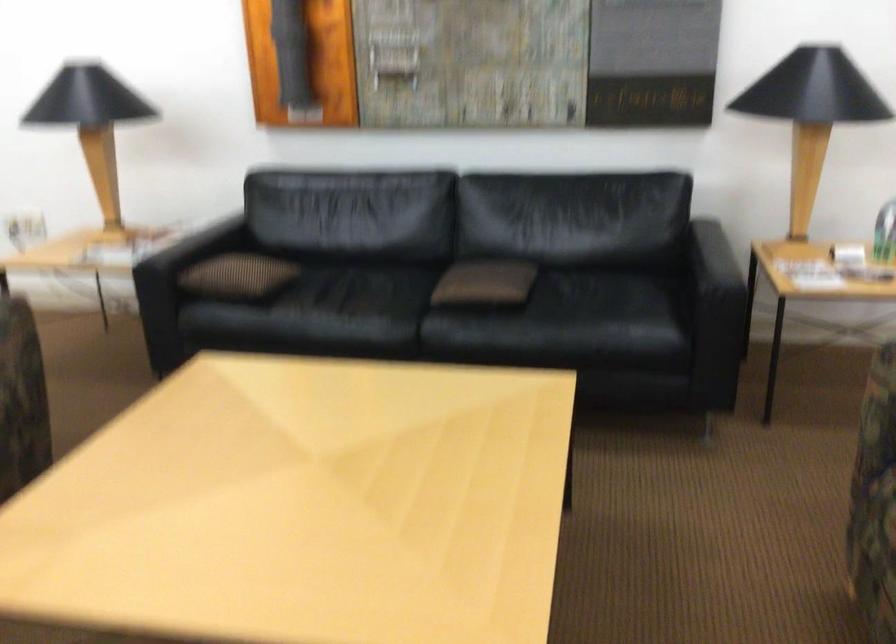
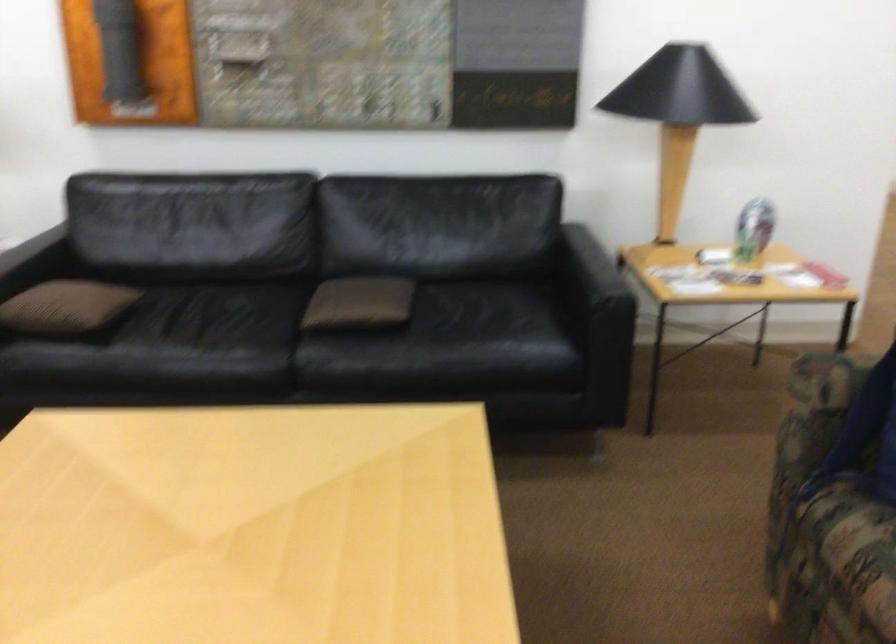
From the picture: What movement of the cameraman would produce the second image?

The cameraman moved toward left, forward.